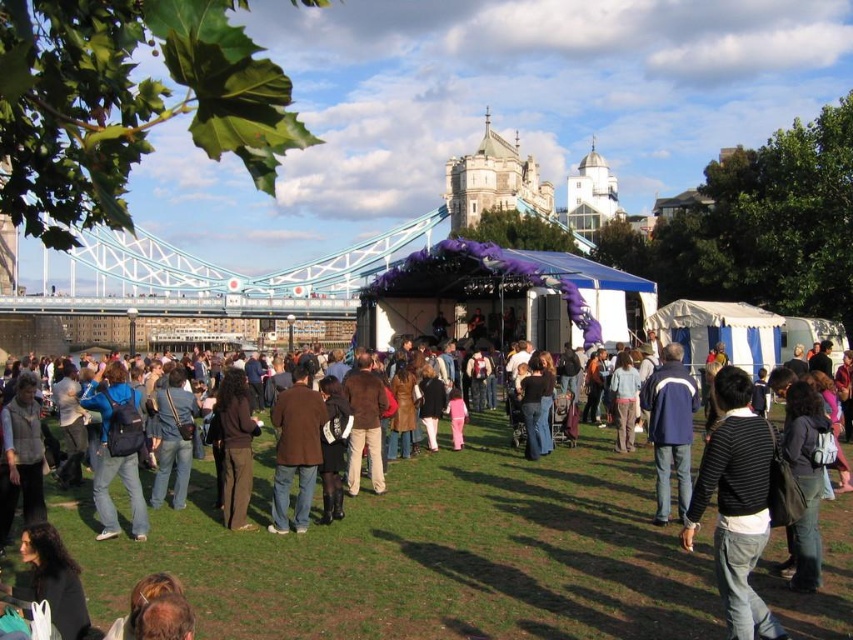
Question: Among these objects, which one is farthest from the camera?

Choices:
 (A) black striped sweater at lower right
 (B) green grass at center
 (C) dark brown pants at center
 (D) blue and white jacket at center

Answer: (C)

Question: Can you confirm if black striped sweater at lower right is positioned to the left of dark brown pants at center?

Choices:
 (A) yes
 (B) no

Answer: (B)

Question: Estimate the real-world distances between objects in this image. Which object is closer to the denim jacket at left?

Choices:
 (A) green grass at center
 (B) brown leather jacket at center
 (C) black striped sweater at lower right

Answer: (B)

Question: Is the position of black striped sweater at lower right less distant than that of denim jacket at left?

Choices:
 (A) yes
 (B) no

Answer: (A)

Question: Does denim jacket at left appear over dark brown pants at center?

Choices:
 (A) no
 (B) yes

Answer: (A)

Question: Among these objects, which one is farthest from the camera?

Choices:
 (A) black striped sweater at lower right
 (B) blue and white jacket at center
 (C) denim jacket at left
 (D) dark brown pants at center

Answer: (D)